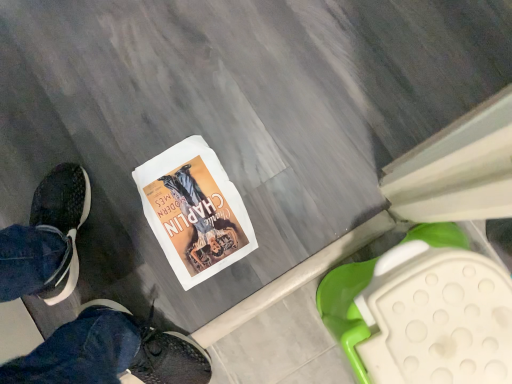
Locate an element on the screen. empty space that is ontop of white paper comic book at center (from a real-world perspective) is located at coordinates (189, 215).